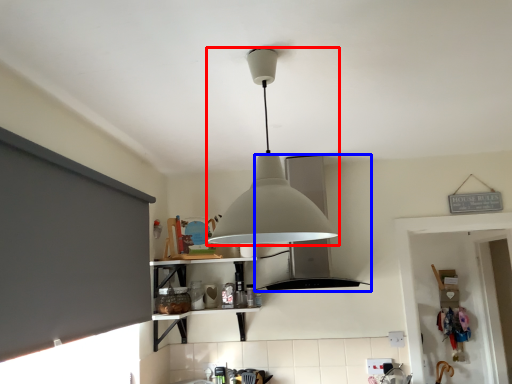
Question: Which object is closer to the camera taking this photo, lamp (highlighted by a red box) or vent (highlighted by a blue box)?

Choices:
 (A) lamp
 (B) vent

Answer: (A)